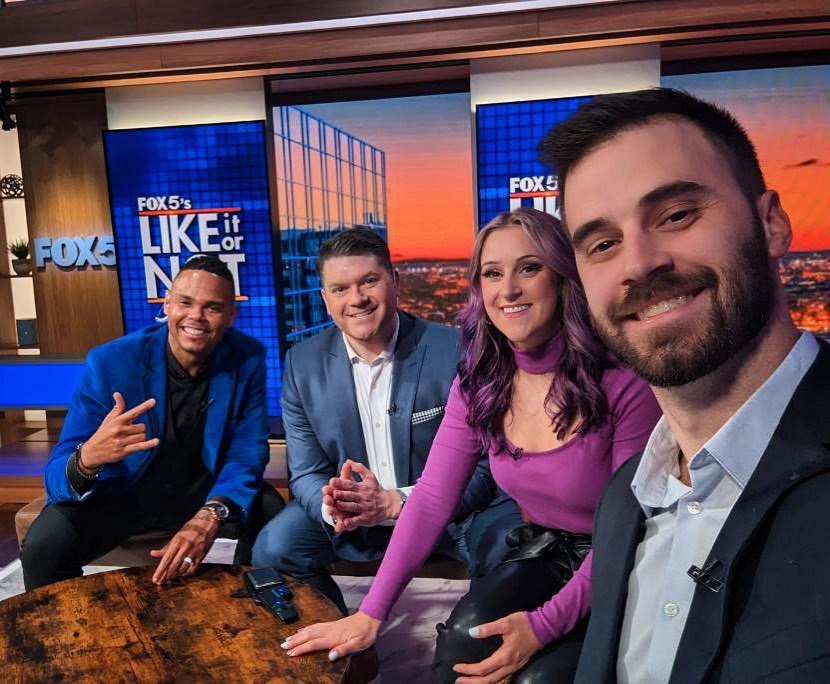
I want to click on tv news room, so click(x=421, y=168).